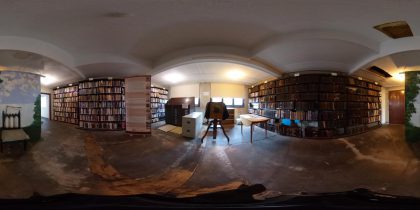
Where is `right table legs`? The height and width of the screenshot is (210, 420). right table legs is located at coordinates (266, 131), (253, 126).